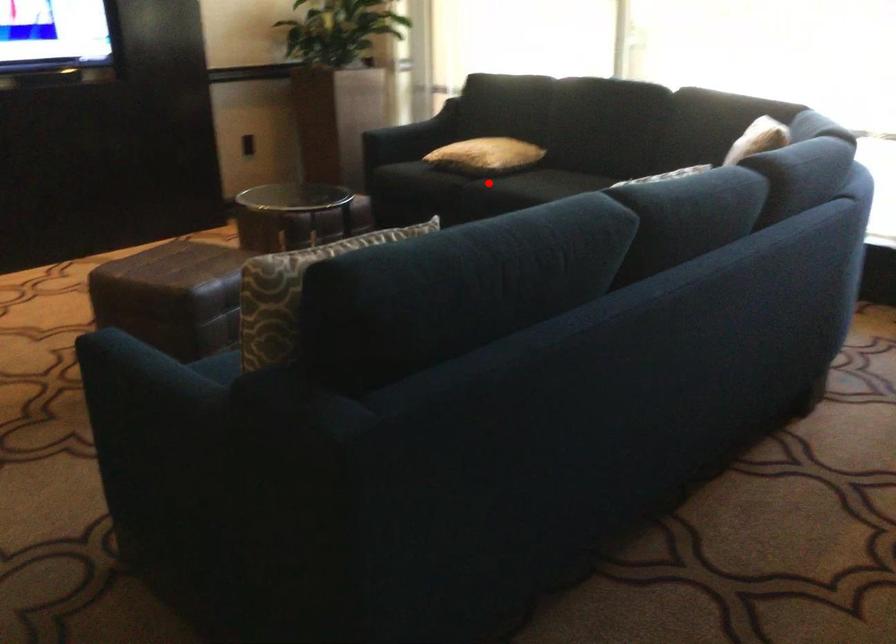
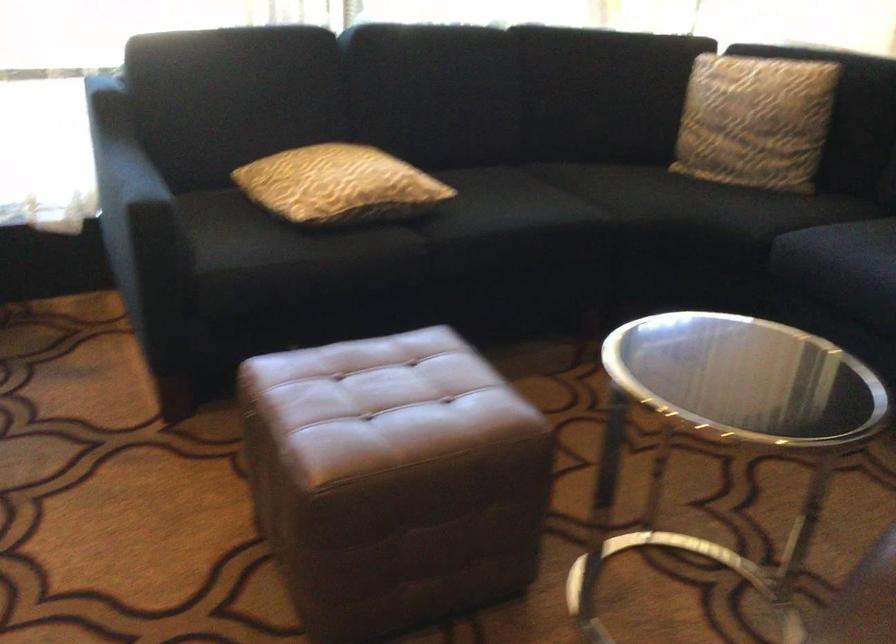
In the second image, find the point that corresponds to the highlighted location in the first image.

(426, 227)